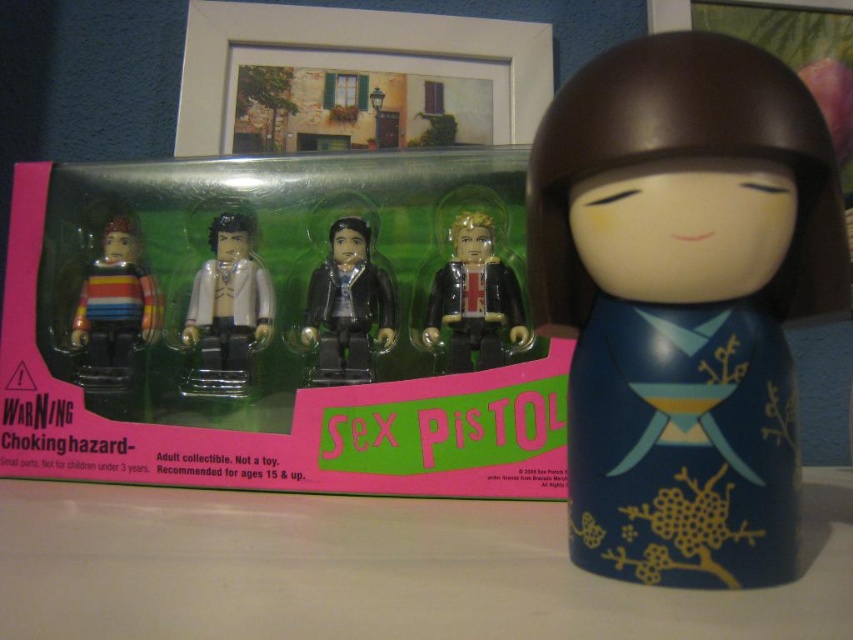
Question: Is white matte minifigure at center above striped fabric figure at left?

Choices:
 (A) yes
 (B) no

Answer: (B)

Question: Can you confirm if shiny gold minifigure at center is smaller than black matte figure at center?

Choices:
 (A) yes
 (B) no

Answer: (A)

Question: Which object is farther from the camera taking this photo?

Choices:
 (A) white matte minifigure at center
 (B) blue glossy doll at center
 (C) striped fabric figure at left

Answer: (C)

Question: Which point is farther to the camera?

Choices:
 (A) (142, 280)
 (B) (357, 358)

Answer: (A)

Question: Which of these objects is positioned closest to the blue glossy doll at center?

Choices:
 (A) shiny gold minifigure at center
 (B) striped fabric figure at left
 (C) black matte figure at center
 (D) white matte minifigure at center

Answer: (A)

Question: Does blue glossy doll at center appear on the right side of black matte figure at center?

Choices:
 (A) yes
 (B) no

Answer: (A)